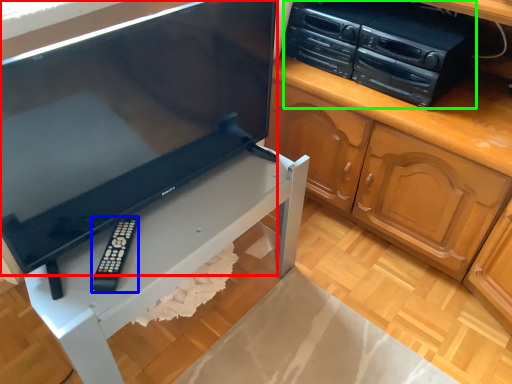
Question: Based on their relative distances, which object is farther from television (highlighted by a red box)? Choose from remote (highlighted by a blue box) and home appliance (highlighted by a green box).

Choices:
 (A) remote
 (B) home appliance

Answer: (B)